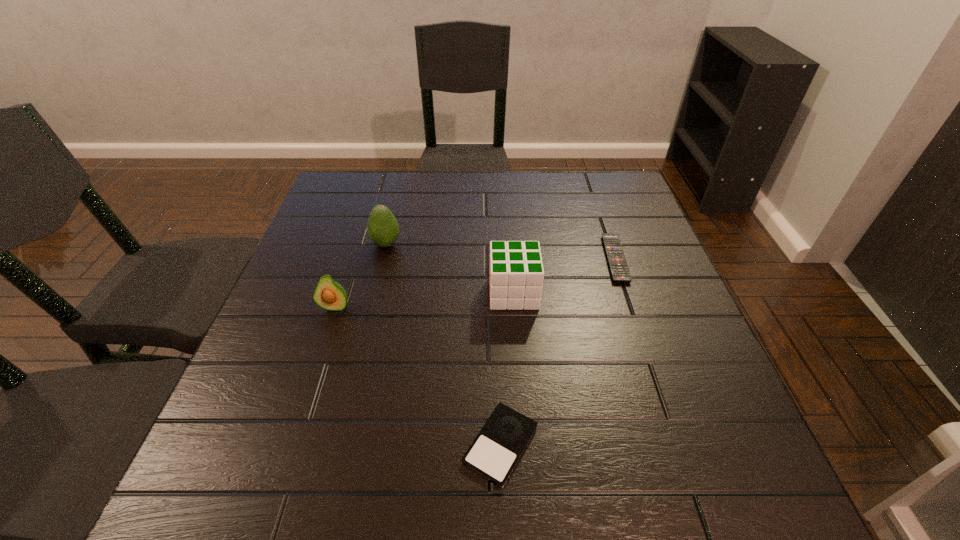
Find the location of a particular element. This screenshot has height=540, width=960. vacant space at the right edge is located at coordinates (671, 320).

The image size is (960, 540). I want to click on free space that is in between the cube and the second object from left to right, so click(449, 268).

This screenshot has width=960, height=540. In order to click on free space between the rightmost object and the nearest object in this screenshot , I will do `click(558, 352)`.

Locate an element on the screen. free spot between the nearer avocado and the rightmost object is located at coordinates (475, 283).

Where is `unoccupied area between the nearer avocado and the second object from left to right`? The width and height of the screenshot is (960, 540). unoccupied area between the nearer avocado and the second object from left to right is located at coordinates (360, 275).

You are a GUI agent. You are given a task and a screenshot of the screen. Output one action in this format:
    pyautogui.click(x=<x>, y=<y>)
    Task: Click on the vacant area that lies between the nearest object and the leftmost object
    Image resolution: width=960 pixels, height=540 pixels.
    Given the screenshot: What is the action you would take?
    pyautogui.click(x=418, y=376)

Where is `empty space that is in between the iPod and the cube`? The width and height of the screenshot is (960, 540). empty space that is in between the iPod and the cube is located at coordinates coord(507,369).

Where is `vacant space in between the cube and the nearer avocado`? vacant space in between the cube and the nearer avocado is located at coordinates (424, 300).

The image size is (960, 540). I want to click on free point between the nearest object and the cube, so click(507, 369).

At what (x,y) coordinates should I click in order to perform the action: click on empty location between the fourth object from right to left and the nearest object. Please return your answer as a coordinate pair (x, y). This screenshot has height=540, width=960. Looking at the image, I should click on (444, 345).